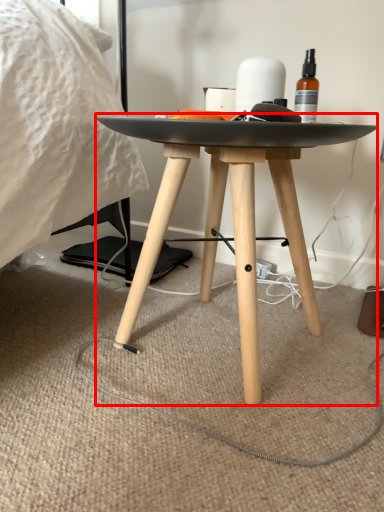
Question: From the image's perspective, what is the correct spatial relationship of table (annotated by the red box) in relation to toilet paper?

Choices:
 (A) below
 (B) above

Answer: (A)